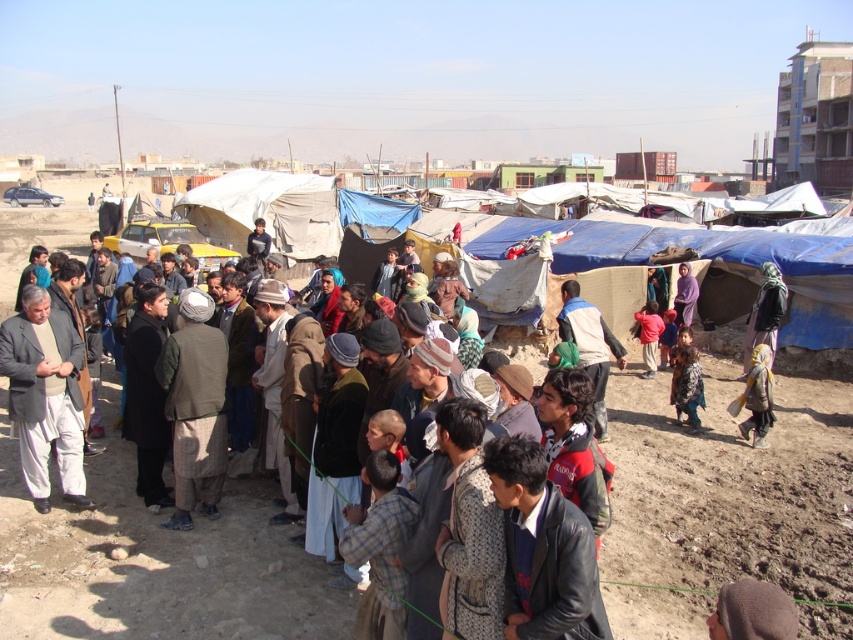
Can you confirm if pink fabric at center is positioned to the right of purple fabric at center?

Incorrect, pink fabric at center is not on the right side of purple fabric at center.

At what (x,y) coordinates should I click in order to perform the action: click on pink fabric at center. Please return your answer as a coordinate pair (x, y). The height and width of the screenshot is (640, 853). Looking at the image, I should click on (648, 333).

Find the location of `pink fabric at center`. pink fabric at center is located at coordinates (648, 333).

Is light brown fabric jacket at left shorter than purple fabric at center?

In fact, light brown fabric jacket at left may be taller than purple fabric at center.

Where is `light brown fabric jacket at left`? light brown fabric jacket at left is located at coordinates (44, 396).

Describe the element at coordinates (44, 396) in the screenshot. I see `light brown fabric jacket at left` at that location.

Locate an element on the screen. This screenshot has height=640, width=853. light brown fabric jacket at left is located at coordinates [44, 396].

Image resolution: width=853 pixels, height=640 pixels. What are the coordinates of `yellow fabric headscarf at lower right` in the screenshot? It's located at (757, 396).

Does yellow fabric headscarf at lower right appear under purple fabric at center?

Correct, yellow fabric headscarf at lower right is located below purple fabric at center.

This screenshot has width=853, height=640. Identify the location of yellow fabric headscarf at lower right. (757, 396).